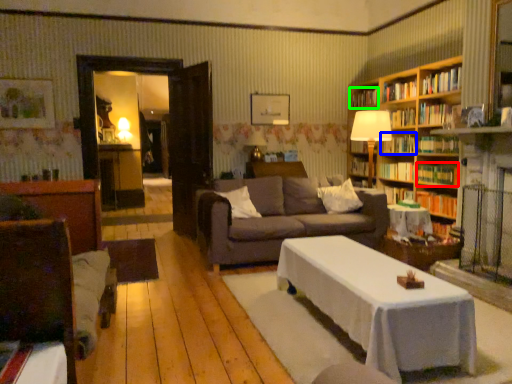
Question: Which is farther away from book (highlighted by a red box)? book (highlighted by a blue box) or book (highlighted by a green box)?

Choices:
 (A) book
 (B) book

Answer: (B)